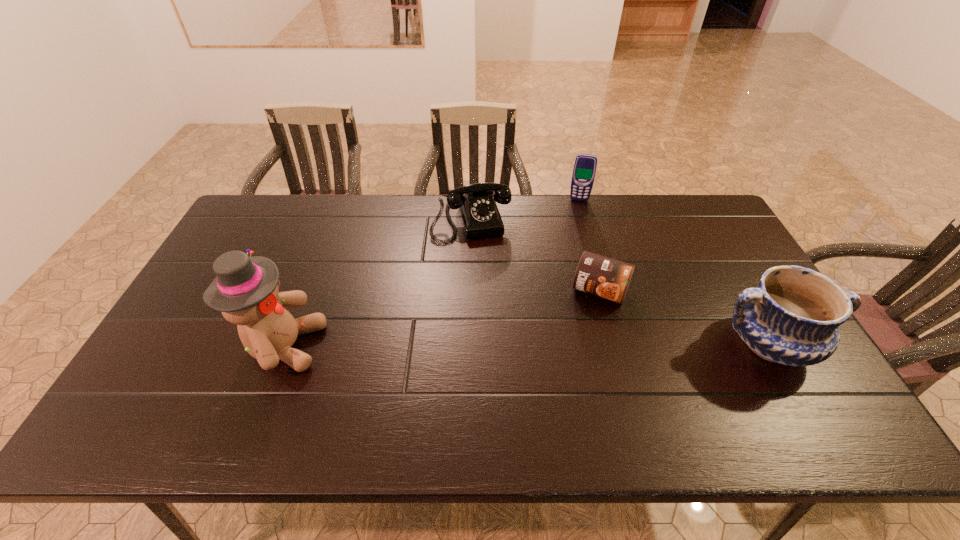
The height and width of the screenshot is (540, 960). I want to click on rag_doll positioned at the near edge, so click(246, 290).

Identify the location of pottery present at the near edge. The height and width of the screenshot is (540, 960). (792, 318).

You are a GUI agent. You are given a task and a screenshot of the screen. Output one action in this format:
    pyautogui.click(x=<x>, y=<y>)
    Task: Click on the object that is at the right edge
    The height and width of the screenshot is (540, 960).
    Given the screenshot: What is the action you would take?
    pyautogui.click(x=792, y=318)

Locate an element on the screen. object that is at the near right corner is located at coordinates (792, 318).

Find the location of `free spot at the far edge of the desktop`. free spot at the far edge of the desktop is located at coordinates (574, 231).

You are a GUI agent. You are given a task and a screenshot of the screen. Output one action in this format:
    pyautogui.click(x=<x>, y=<y>)
    Task: Click on the vacant region at the near edge of the desktop
    
    Given the screenshot: What is the action you would take?
    pyautogui.click(x=265, y=381)

This screenshot has width=960, height=540. What are the coordinates of `free space at the left edge of the desktop` in the screenshot? It's located at (205, 289).

Where is `vacant region at the right edge`? This screenshot has height=540, width=960. vacant region at the right edge is located at coordinates (731, 277).

Locate an element on the screen. This screenshot has width=960, height=540. vacant region at the far right corner of the desktop is located at coordinates (693, 210).

This screenshot has height=540, width=960. I want to click on vacant space at the near right corner of the desktop, so click(804, 396).